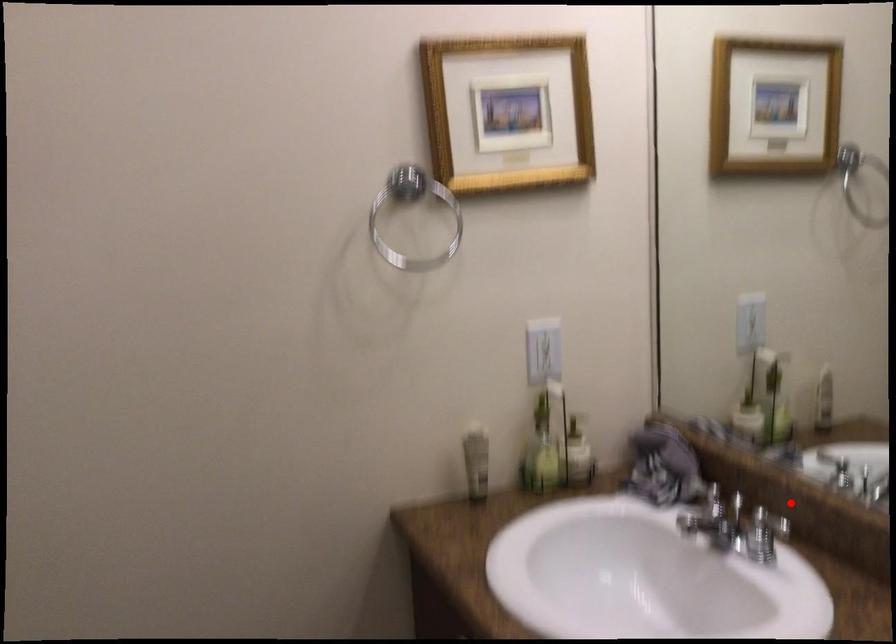
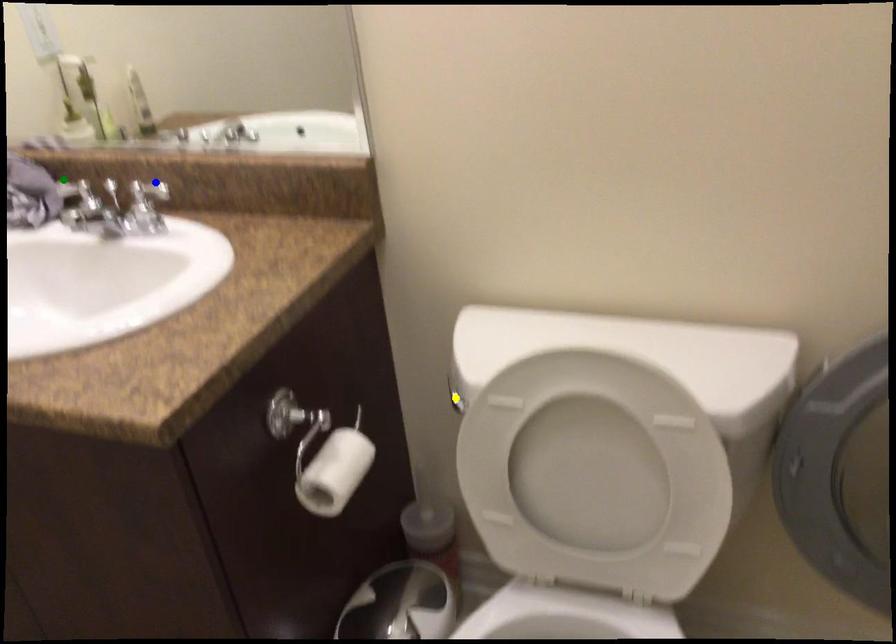
Question: I am providing you with two images of the same scene from different viewpoints. A red point is marked on the first image. You are given multiple points on the second image. Which point in image 2 is actually the same real-world point as the red point in image 1?

Choices:
 (A) blue point
 (B) yellow point
 (C) green point

Answer: (A)